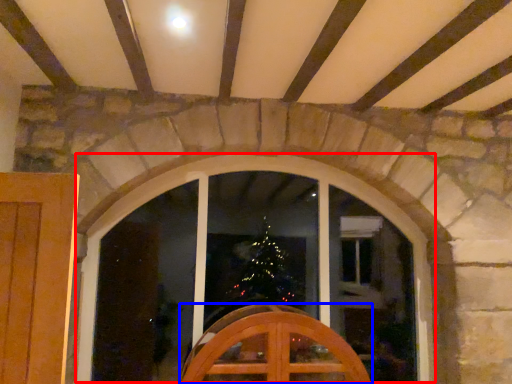
Question: Which object appears closest to the camera in this image, window (highlighted by a red box) or furniture (highlighted by a blue box)?

Choices:
 (A) window
 (B) furniture

Answer: (B)